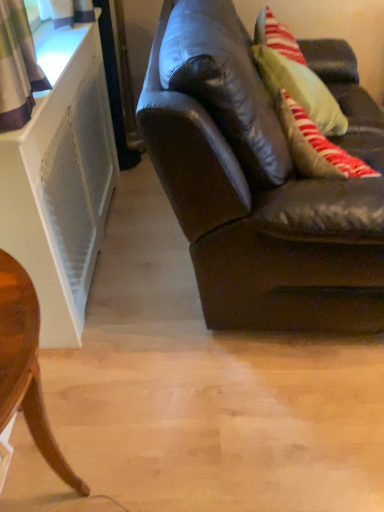
Question: From the image's perspective, is wooden round table at lower left located above or below brown leather couch at right?

Choices:
 (A) below
 (B) above

Answer: (A)

Question: Looking at their shapes, would you say wooden round table at lower left is wider or thinner than brown leather couch at right?

Choices:
 (A) wide
 (B) thin

Answer: (B)

Question: Is wooden round table at lower left spatially inside brown leather couch at right, or outside of it?

Choices:
 (A) inside
 (B) outside

Answer: (B)

Question: In terms of height, does brown leather couch at right look taller or shorter compared to wooden round table at lower left?

Choices:
 (A) short
 (B) tall

Answer: (B)

Question: Based on their sizes in the image, would you say brown leather couch at right is bigger or smaller than wooden round table at lower left?

Choices:
 (A) small
 (B) big

Answer: (B)

Question: Considering their positions, is brown leather couch at right located in front of or behind wooden round table at lower left?

Choices:
 (A) behind
 (B) front

Answer: (A)

Question: Considering the positions of point (223, 214) and point (31, 395), is point (223, 214) closer or farther from the camera than point (31, 395)?

Choices:
 (A) farther
 (B) closer

Answer: (A)